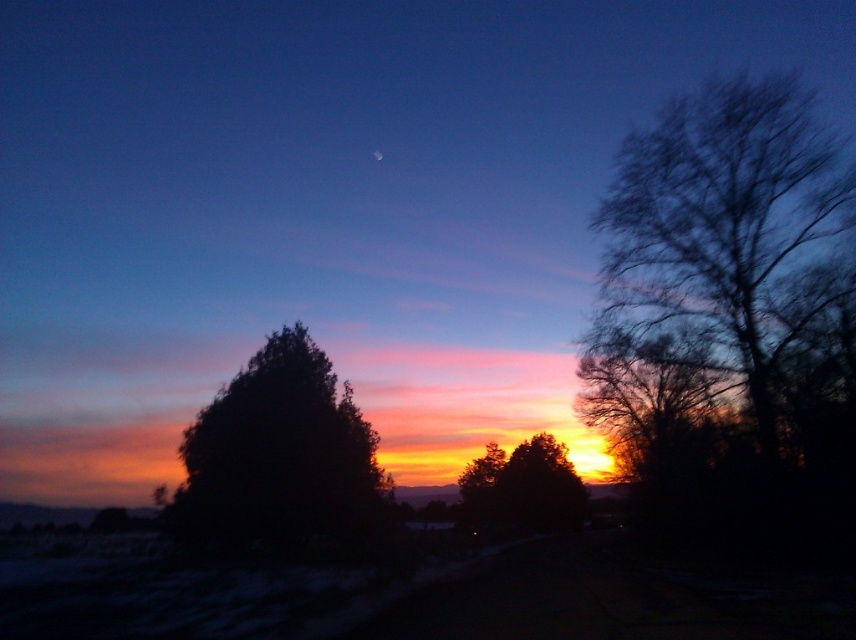
You are standing at the point marked by the coordinates point (278, 456) in the image, which is the dark green leafy tree at center. You want to walk towards the sun. Which direction should you face?

Since the sun is setting at the horizon near the point where the sky transitions from orange to deep blue, you should face towards the direction of the horizon where the sun is located. However, since the sun is partially obscured by trees, you might need to look between the tree branches to see it clearly. The exact direction depends on the orientation of the image, but generally, in sunset scenes, the sun is in the west. However, based on the image description, the sun is near the horizon in the area with

You are an artist trying to paint the sunset scene. You have two brushes available. One is a thin brush for detailed work and the other is a thick brush for broader strokes. Given the scene described, which brush should you use for the bare branches at right and which for the silhouette tree at center?

The bare branches at right are thinner, so use the thin brush for detailed work. The silhouette tree at center is thicker, so use the thick brush for broader strokes.